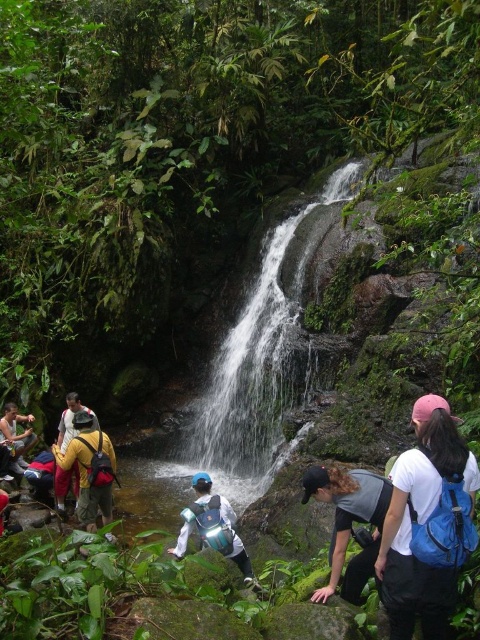
Question: Which object appears farthest from the camera in this image?

Choices:
 (A) yellow backpack at lower left
 (B) white matte wetsuit at center
 (C) white smooth waterfall at center
 (D) green mossy rock at center

Answer: (C)

Question: Can you confirm if white matte wetsuit at center is wider than yellow backpack at left?

Choices:
 (A) no
 (B) yes

Answer: (B)

Question: Does white matte backpack at right have a greater width compared to dark gray fabric cap at center?

Choices:
 (A) no
 (B) yes

Answer: (A)

Question: Does yellow backpack at lower left appear over green mossy rock at center?

Choices:
 (A) yes
 (B) no

Answer: (B)

Question: Which of the following is the farthest from the observer?

Choices:
 (A) (327, 614)
 (B) (415, 588)
 (C) (187, 509)

Answer: (C)

Question: Among these objects, which one is farthest from the camera?

Choices:
 (A) white matte backpack at right
 (B) white smooth waterfall at center

Answer: (B)